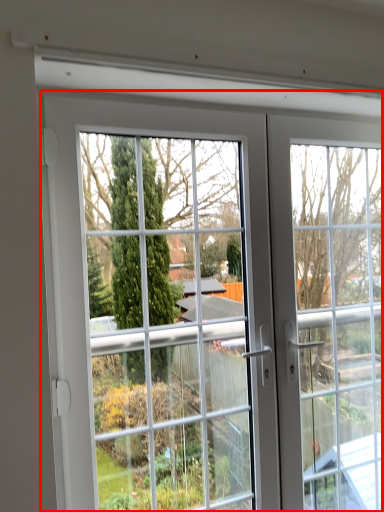
Question: From the image's perspective, what is the correct spatial relationship of door (annotated by the red box) in relation to window frame?

Choices:
 (A) above
 (B) below

Answer: (A)